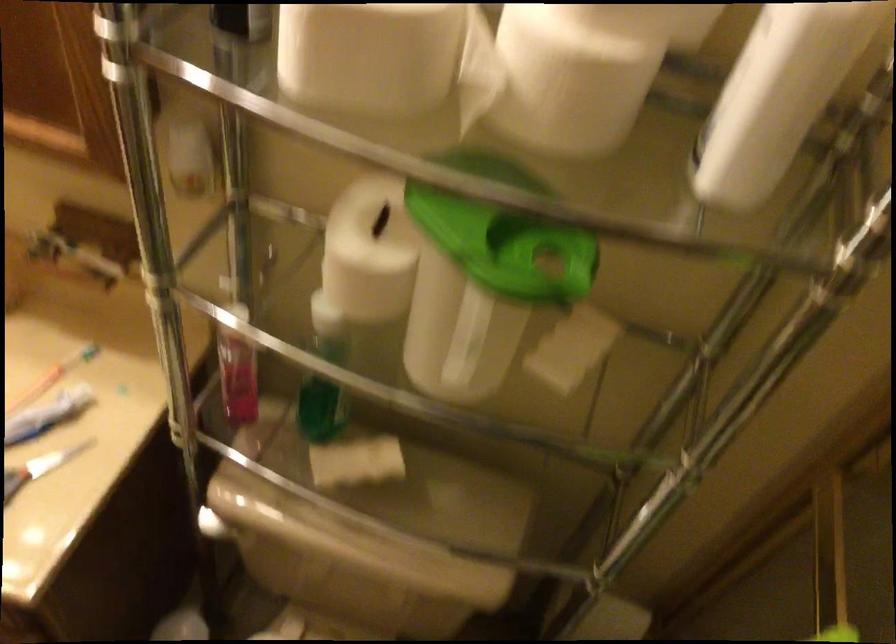
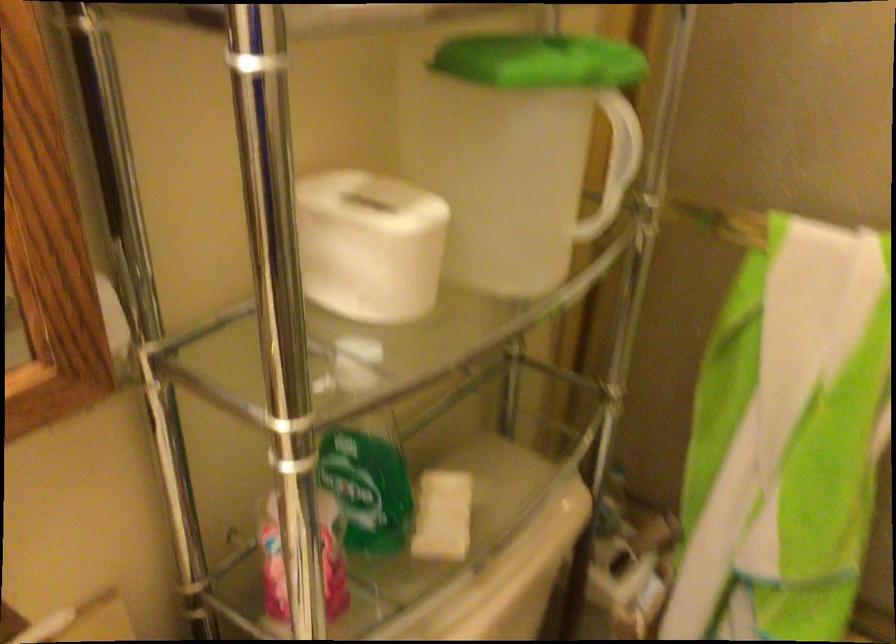
The point at (329, 237) is marked in the first image. Where is the corresponding point in the second image?

(369, 245)